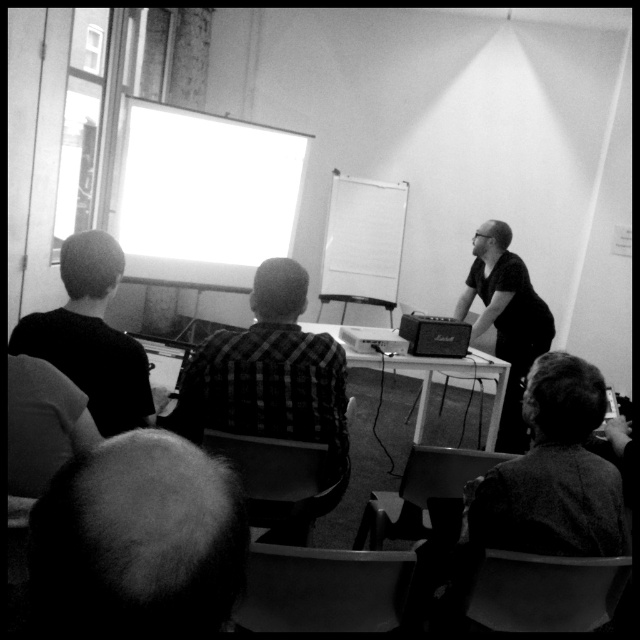
Does white glossy projection screen at upper left have a larger size compared to white matte projection screen at center?

Indeed, white glossy projection screen at upper left has a larger size compared to white matte projection screen at center.

Who is more distant from viewer, (216, 182) or (353, 200)?

The point (353, 200) is behind.

Where is `white glossy projection screen at upper left`? white glossy projection screen at upper left is located at coordinates (204, 188).

Who is lower down, white glossy projection screen at upper left or dark hair at left?

dark hair at left is below.

Who is higher up, white glossy projection screen at upper left or dark hair at left?

Positioned higher is white glossy projection screen at upper left.

What do you see at coordinates (204, 188) in the screenshot?
I see `white glossy projection screen at upper left` at bounding box center [204, 188].

Where is `white glossy projection screen at upper left`? The width and height of the screenshot is (640, 640). white glossy projection screen at upper left is located at coordinates (204, 188).

Which is in front, point (157, 196) or point (285, 372)?

Point (285, 372)

Does point (234, 157) lie behind point (198, 429)?

Yes, it is behind point (198, 429).

Between point (122, 147) and point (284, 339), which one is positioned in front?

Point (284, 339) is more forward.

The width and height of the screenshot is (640, 640). Find the location of `white glossy projection screen at upper left`. white glossy projection screen at upper left is located at coordinates (204, 188).